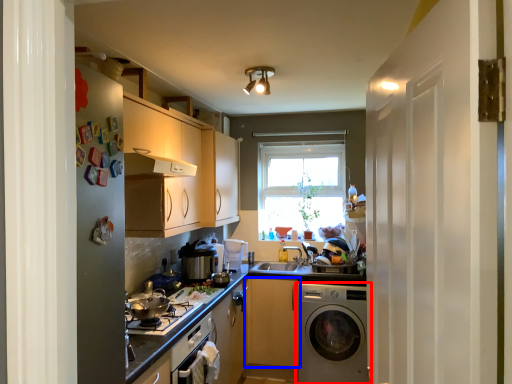
Question: Which object is closer to the camera taking this photo, washing machine (highlighted by a red box) or cabinetry (highlighted by a blue box)?

Choices:
 (A) washing machine
 (B) cabinetry

Answer: (A)